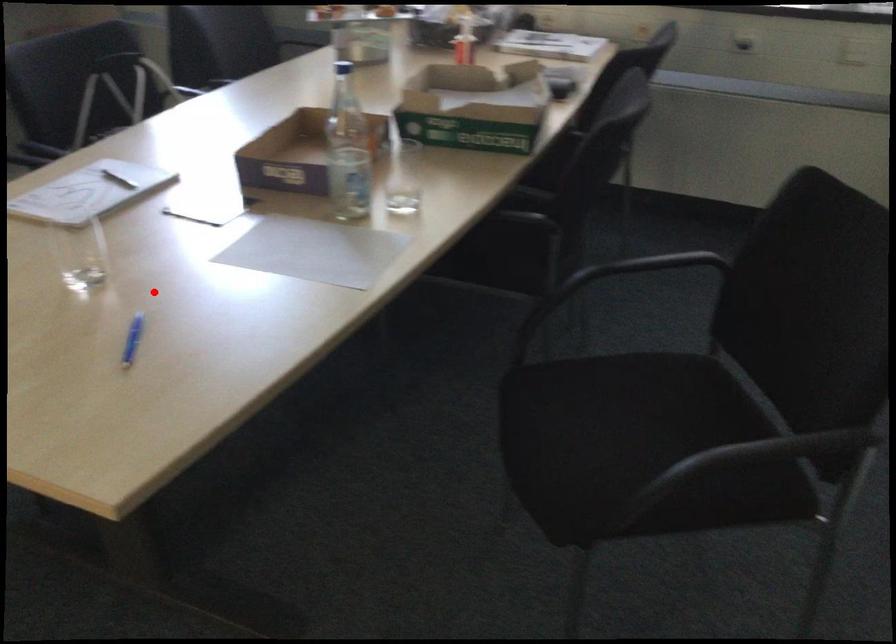
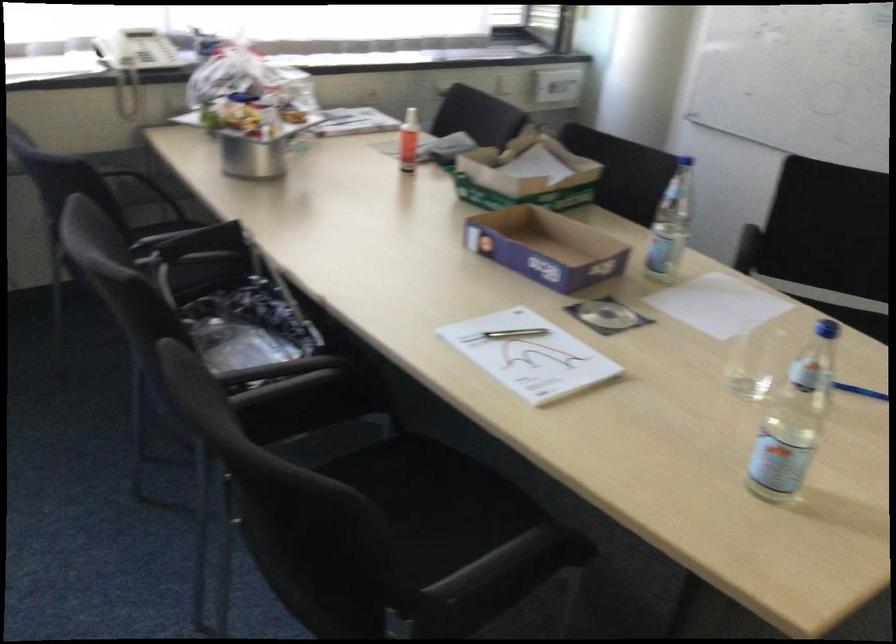
Locate, in the second image, the point that corresponds to the highlighted location in the first image.

(754, 362)